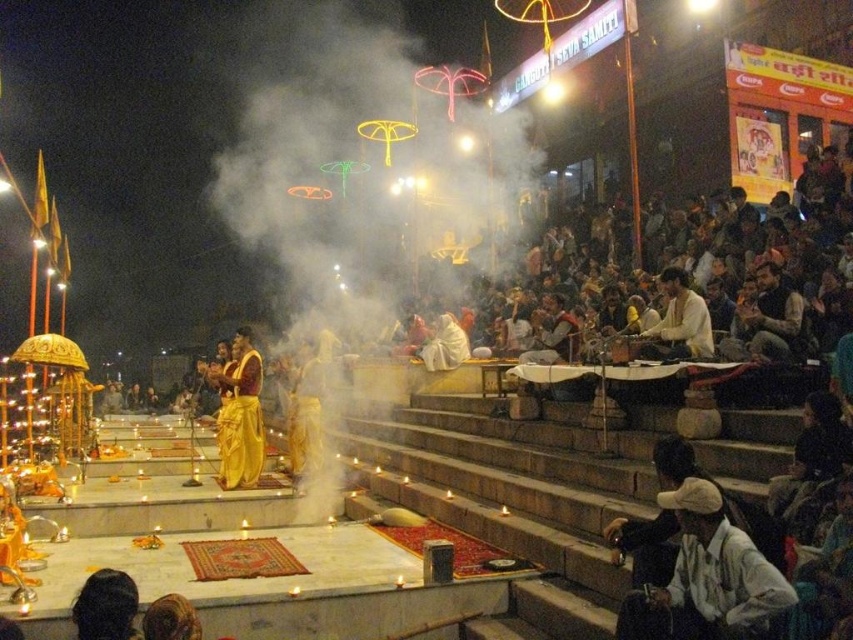
Question: Is white cotton cap at lower right to the right of white cotton shirt at center from the viewer's perspective?

Choices:
 (A) yes
 (B) no

Answer: (B)

Question: Among these objects, which one is nearest to the camera?

Choices:
 (A) golden silk sari at center
 (B) white cotton shirt at center
 (C) white smoke at center

Answer: (B)

Question: Does white smoke at center appear on the left side of golden silk sari at center?

Choices:
 (A) no
 (B) yes

Answer: (A)

Question: Which of the following is the farthest from the observer?

Choices:
 (A) (259, 388)
 (B) (746, 563)
 (C) (641, 348)
 (D) (297, 65)

Answer: (D)

Question: Is white cotton cap at lower right thinner than white cotton shirt at center?

Choices:
 (A) no
 (B) yes

Answer: (B)

Question: Which is farther from the white cotton cap at lower right?

Choices:
 (A) white cotton shirt at center
 (B) golden silk sari at center

Answer: (B)